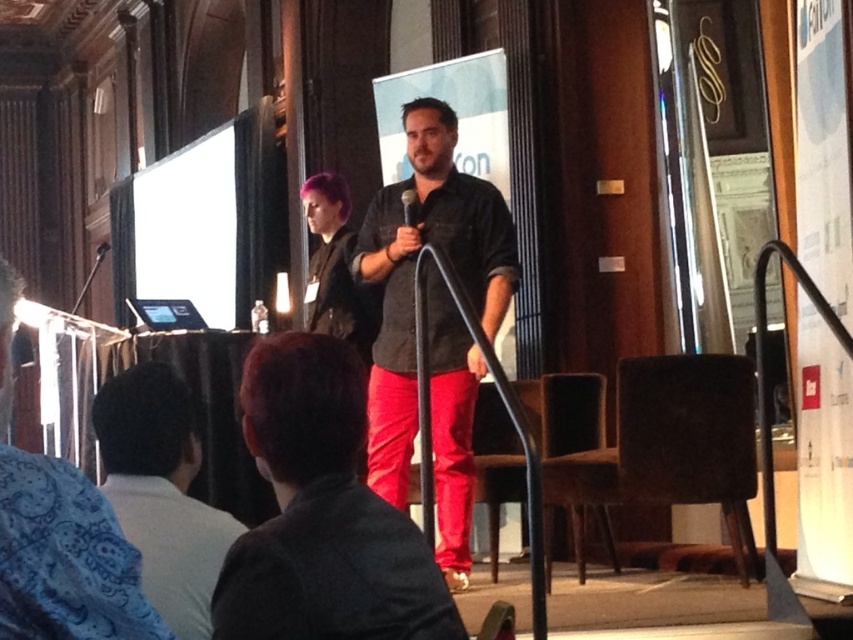
Can you confirm if smooth black shirt at center is wider than matte black shirt at center?

No, smooth black shirt at center is not wider than matte black shirt at center.

Is point (374, 628) farther from camera compared to point (389, 184)?

No.

I want to click on smooth black shirt at center, so pos(322,513).

The height and width of the screenshot is (640, 853). What are the coordinates of `matte black shirt at center` in the screenshot? It's located at (413, 273).

Is matte black shirt at center in front of black matte microphone at center?

Yes, matte black shirt at center is closer to the viewer.

The width and height of the screenshot is (853, 640). What do you see at coordinates (413, 273) in the screenshot? I see `matte black shirt at center` at bounding box center [413, 273].

The width and height of the screenshot is (853, 640). I want to click on matte black shirt at center, so click(x=413, y=273).

Is matte black shirt at center wider than light brown leather jacket at lower left?

Yes, matte black shirt at center is wider than light brown leather jacket at lower left.

From the picture: Is matte black shirt at center bigger than light brown leather jacket at lower left?

Correct, matte black shirt at center is larger in size than light brown leather jacket at lower left.

Who is more forward, (x=390, y=200) or (x=109, y=456)?

Point (x=109, y=456)

Locate an element on the screen. The height and width of the screenshot is (640, 853). matte black shirt at center is located at coordinates (413, 273).